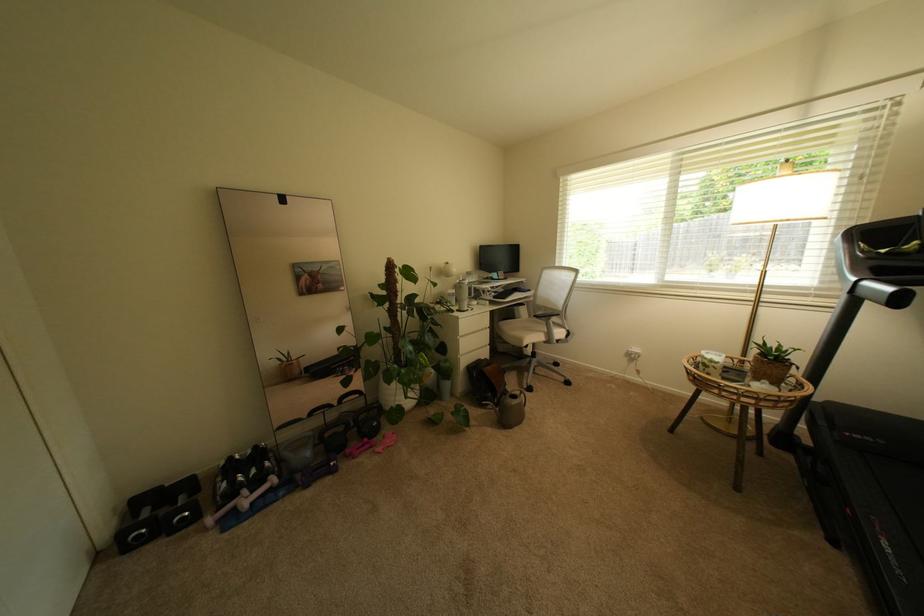
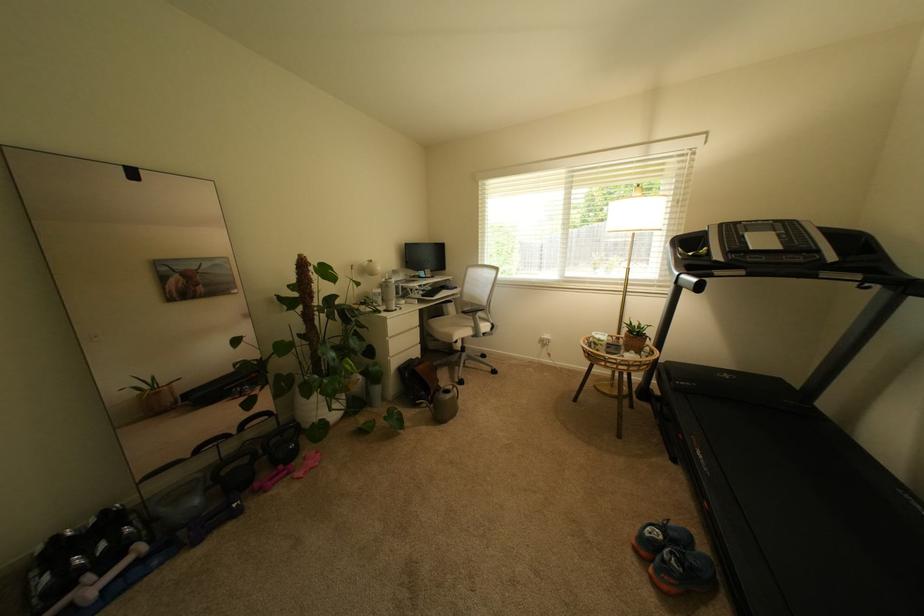
Locate, in the second image, the point that corresponds to point (467, 339) in the first image.

(395, 339)